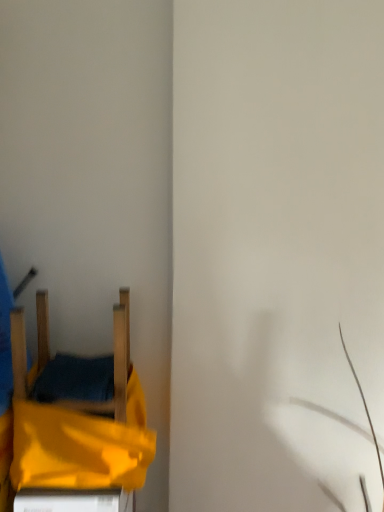
Question: Does wooden chair at left have a greater height compared to yellow fabric bed at lower left?

Choices:
 (A) no
 (B) yes

Answer: (B)

Question: Is wooden chair at left completely or partially outside of yellow fabric bed at lower left?

Choices:
 (A) yes
 (B) no

Answer: (A)

Question: Is wooden chair at left facing towards yellow fabric bed at lower left?

Choices:
 (A) no
 (B) yes

Answer: (A)

Question: Does wooden chair at left have a larger size compared to yellow fabric bed at lower left?

Choices:
 (A) yes
 (B) no

Answer: (B)

Question: Does wooden chair at left have a lesser width compared to yellow fabric bed at lower left?

Choices:
 (A) yes
 (B) no

Answer: (A)

Question: From a real-world perspective, is wooden chair at left positioned under yellow fabric bed at lower left based on gravity?

Choices:
 (A) no
 (B) yes

Answer: (A)

Question: Does yellow fabric bed at lower left have a lesser height compared to wooden chair at left?

Choices:
 (A) no
 (B) yes

Answer: (B)

Question: Is yellow fabric bed at lower left far away from wooden chair at left?

Choices:
 (A) yes
 (B) no

Answer: (B)

Question: Is yellow fabric bed at lower left at the left side of wooden chair at left?

Choices:
 (A) yes
 (B) no

Answer: (B)

Question: From a real-world perspective, is yellow fabric bed at lower left over wooden chair at left?

Choices:
 (A) no
 (B) yes

Answer: (A)

Question: Does yellow fabric bed at lower left appear on the right side of wooden chair at left?

Choices:
 (A) yes
 (B) no

Answer: (A)

Question: Could you tell me if yellow fabric bed at lower left is facing wooden chair at left?

Choices:
 (A) yes
 (B) no

Answer: (B)

Question: Does point (115, 348) appear closer or farther from the camera than point (130, 458)?

Choices:
 (A) farther
 (B) closer

Answer: (B)